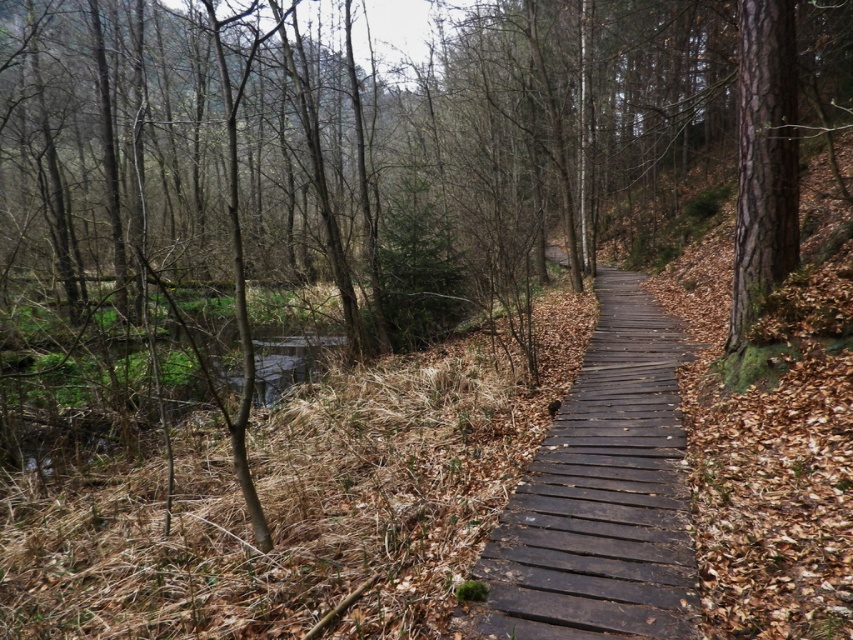
Question: From the image, what is the correct spatial relationship of dark brown wooden path at center in relation to smooth bark tree at right?

Choices:
 (A) below
 (B) above

Answer: (A)

Question: Does dark brown wooden path at center have a greater width compared to smooth bark tree at right?

Choices:
 (A) yes
 (B) no

Answer: (A)

Question: Does dark brown wooden path at center appear under smooth bark tree at right?

Choices:
 (A) no
 (B) yes

Answer: (B)

Question: Among these objects, which one is nearest to the camera?

Choices:
 (A) dark brown wooden path at center
 (B) smooth bark tree at right

Answer: (A)

Question: Which object is farther from the camera taking this photo?

Choices:
 (A) dark brown wooden path at center
 (B) smooth bark tree at right

Answer: (B)